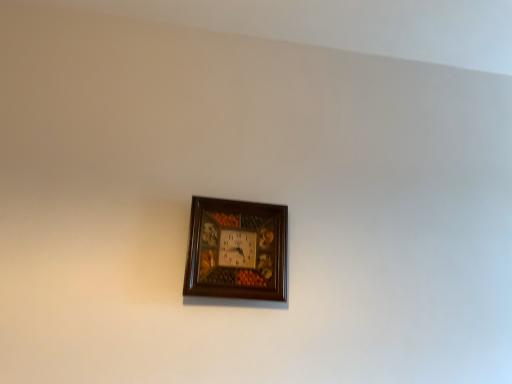
This screenshot has height=384, width=512. Identify the location of wooden clock at center. (237, 250).

What do you see at coordinates (237, 250) in the screenshot? I see `wooden clock at center` at bounding box center [237, 250].

Image resolution: width=512 pixels, height=384 pixels. What are the coordinates of `wooden clock at center` in the screenshot? It's located at (237, 250).